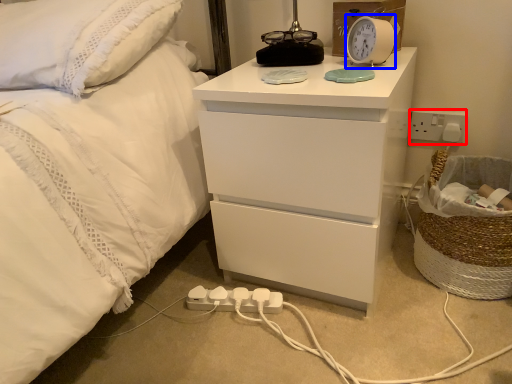
Question: Which object is closer to the camera taking this photo, electric outlet (highlighted by a red box) or alarm clock (highlighted by a blue box)?

Choices:
 (A) electric outlet
 (B) alarm clock

Answer: (B)